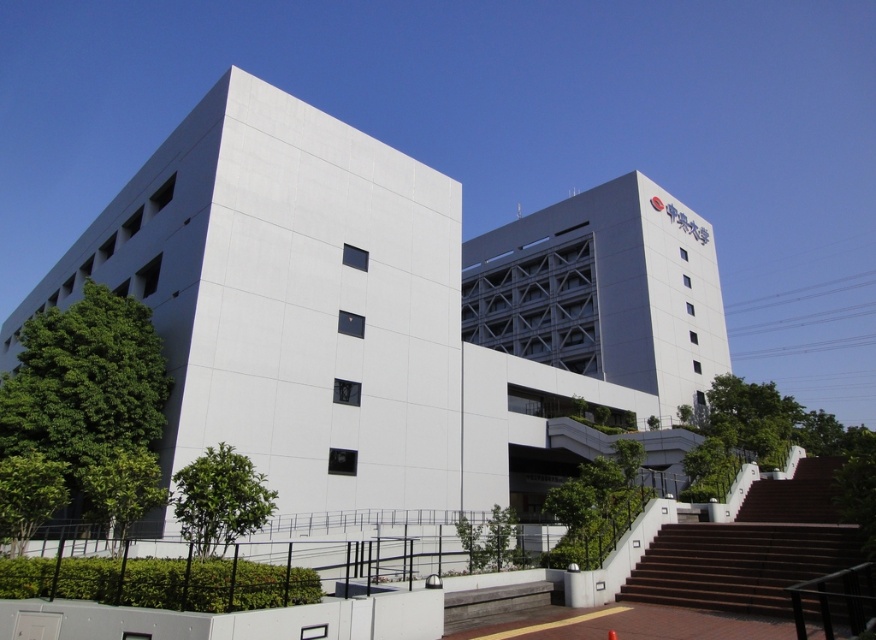
Question: Which object appears closest to the camera in this image?

Choices:
 (A) brown wooden stairs at lower right
 (B) white matte building at center

Answer: (A)

Question: Among these objects, which one is nearest to the camera?

Choices:
 (A) brown wooden stairs at lower right
 (B) white matte building at center

Answer: (A)

Question: Is white smooth building at center positioned at the back of white matte building at center?

Choices:
 (A) yes
 (B) no

Answer: (B)

Question: Which of the following is the closest to the observer?

Choices:
 (A) (319, 125)
 (B) (670, 380)

Answer: (A)

Question: Can you confirm if white smooth building at center is smaller than brown wooden stairs at lower right?

Choices:
 (A) yes
 (B) no

Answer: (B)

Question: Is white smooth building at center to the left of white matte building at center from the viewer's perspective?

Choices:
 (A) no
 (B) yes

Answer: (B)